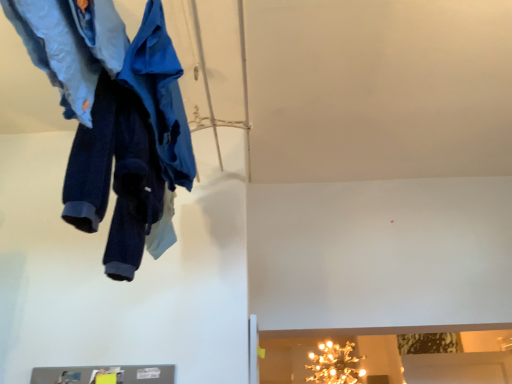
Describe the element at coordinates (335, 364) in the screenshot. I see `gold metallic chandelier at upper center` at that location.

This screenshot has height=384, width=512. I want to click on blue fabric coat at upper left, so pos(161,95).

Find the location of a particular element. The height and width of the screenshot is (384, 512). light fixture to the right of denim pants at upper left, placed as the second trousers when sorted from back to front is located at coordinates (335, 364).

From a real-world perspective, which object stands above the other?

denim pants at upper left, the 1th trousers from the front, is physically above.

Considering the sizes of denim pants at upper left, the 1th trousers from the front, and gold metallic chandelier at upper center in the image, is denim pants at upper left, the 1th trousers from the front, taller or shorter than gold metallic chandelier at upper center?

In the image, denim pants at upper left, the 1th trousers from the front, appears to be shorter than gold metallic chandelier at upper center.

From the picture: Considering the relative positions of denim pants at upper left, placed as the second trousers when sorted from back to front, and blue fabric coat at upper left in the image provided, is denim pants at upper left, placed as the second trousers when sorted from back to front, to the right of blue fabric coat at upper left from the viewer's perspective?

No, denim pants at upper left, placed as the second trousers when sorted from back to front, is not to the right of blue fabric coat at upper left.

You are a GUI agent. You are given a task and a screenshot of the screen. Output one action in this format:
    pyautogui.click(x=<x>, y=<y>)
    Task: Click on the 1st trousers directly beneath the blue fabric coat at upper left (from a real-world perspective)
    The height and width of the screenshot is (384, 512).
    Given the screenshot: What is the action you would take?
    pyautogui.click(x=71, y=46)

From the image's perspective, is denim pants at upper left, placed as the second trousers when sorted from back to front, located above blue fabric coat at upper left?

Yes, from the image's perspective, denim pants at upper left, placed as the second trousers when sorted from back to front, is above blue fabric coat at upper left.

Is denim pants at upper left, the 1th trousers from the front, placed right next to blue fabric coat at upper left?

denim pants at upper left, the 1th trousers from the front, and blue fabric coat at upper left are clearly separated.

From the image's perspective, which one is positioned lower, navy blue fleece pants at upper left, which is the second trousers from front to back, or denim pants at upper left, placed as the second trousers when sorted from back to front?

From the image's view, navy blue fleece pants at upper left, which is the second trousers from front to back, is below.

Considering the relative positions of navy blue fleece pants at upper left, which is the second trousers from front to back, and denim pants at upper left, placed as the second trousers when sorted from back to front, in the image provided, is navy blue fleece pants at upper left, which is the second trousers from front to back, to the left of denim pants at upper left, placed as the second trousers when sorted from back to front, from the viewer's perspective?

Incorrect, navy blue fleece pants at upper left, which is the second trousers from front to back, is not on the left side of denim pants at upper left, placed as the second trousers when sorted from back to front.

Is navy blue fleece pants at upper left, which is the second trousers from front to back, turned away from denim pants at upper left, placed as the second trousers when sorted from back to front?

No, navy blue fleece pants at upper left, which is the second trousers from front to back, is not facing the opposite direction of denim pants at upper left, placed as the second trousers when sorted from back to front.

From a real-world perspective, is gold metallic chandelier at upper center below navy blue fleece pants at upper left, which is the first trousers in back-to-front order?

Correct, in the physical world, gold metallic chandelier at upper center is lower than navy blue fleece pants at upper left, which is the first trousers in back-to-front order.

Considering their positions, is gold metallic chandelier at upper center located in front of or behind navy blue fleece pants at upper left, which is the first trousers in back-to-front order?

Clearly, gold metallic chandelier at upper center is behind navy blue fleece pants at upper left, which is the first trousers in back-to-front order.

What's the angular difference between gold metallic chandelier at upper center and navy blue fleece pants at upper left, which is the second trousers from front to back,'s facing directions?

The angle between the facing direction of gold metallic chandelier at upper center and the facing direction of navy blue fleece pants at upper left, which is the second trousers from front to back, is 171 degrees.

From their relative heights in the image, would you say denim pants at upper left, the 1th trousers from the front, is taller or shorter than navy blue fleece pants at upper left, which is the first trousers in back-to-front order?

Clearly, denim pants at upper left, the 1th trousers from the front, is shorter compared to navy blue fleece pants at upper left, which is the first trousers in back-to-front order.

Would you consider denim pants at upper left, the 1th trousers from the front, to be distant from navy blue fleece pants at upper left, which is the first trousers in back-to-front order?

That's not correct — denim pants at upper left, the 1th trousers from the front, is a little close to navy blue fleece pants at upper left, which is the first trousers in back-to-front order.

Is navy blue fleece pants at upper left, which is the second trousers from front to back, a part of denim pants at upper left, placed as the second trousers when sorted from back to front?

No, denim pants at upper left, placed as the second trousers when sorted from back to front, does not contain navy blue fleece pants at upper left, which is the second trousers from front to back.

Is navy blue fleece pants at upper left, which is the first trousers in back-to-front order, outside of gold metallic chandelier at upper center?

navy blue fleece pants at upper left, which is the first trousers in back-to-front order, lies outside gold metallic chandelier at upper center's area.

Who is bigger, navy blue fleece pants at upper left, which is the first trousers in back-to-front order, or gold metallic chandelier at upper center?

gold metallic chandelier at upper center is bigger.

Based on the photo, does navy blue fleece pants at upper left, which is the first trousers in back-to-front order, have a lesser width compared to gold metallic chandelier at upper center?

Yes, navy blue fleece pants at upper left, which is the first trousers in back-to-front order, is thinner than gold metallic chandelier at upper center.

Can you tell me how much navy blue fleece pants at upper left, which is the first trousers in back-to-front order, and gold metallic chandelier at upper center differ in facing direction?

The facing directions of navy blue fleece pants at upper left, which is the first trousers in back-to-front order, and gold metallic chandelier at upper center are 171 degrees apart.

Can you confirm if gold metallic chandelier at upper center is thinner than denim pants at upper left, placed as the second trousers when sorted from back to front?

In fact, gold metallic chandelier at upper center might be wider than denim pants at upper left, placed as the second trousers when sorted from back to front.

Who is shorter, gold metallic chandelier at upper center or denim pants at upper left, the 1th trousers from the front?

With less height is denim pants at upper left, the 1th trousers from the front.

Considering their positions, is gold metallic chandelier at upper center located in front of or behind denim pants at upper left, placed as the second trousers when sorted from back to front?

In the image, gold metallic chandelier at upper center appears behind denim pants at upper left, placed as the second trousers when sorted from back to front.

From a real-world perspective, count 2nd trouserss upward from the gold metallic chandelier at upper center and point to it. Please provide its 2D coordinates.

[(71, 46)]

Identify the location of trousers that is the 1st object directly below the blue fabric coat at upper left (from a real-world perspective). (71, 46).

Considering their positions, is blue fabric coat at upper left positioned closer to gold metallic chandelier at upper center than denim pants at upper left, placed as the second trousers when sorted from back to front?

The object closer to gold metallic chandelier at upper center is blue fabric coat at upper left.

Estimate the real-world distances between objects in this image. Which object is closer to gold metallic chandelier at upper center, navy blue fleece pants at upper left, which is the second trousers from front to back, or blue fabric coat at upper left?

The object closer to gold metallic chandelier at upper center is navy blue fleece pants at upper left, which is the second trousers from front to back.

Which object lies nearer to the anchor point blue fabric coat at upper left, gold metallic chandelier at upper center or navy blue fleece pants at upper left, which is the second trousers from front to back?

navy blue fleece pants at upper left, which is the second trousers from front to back.

Consider the image. Which object lies further to the anchor point denim pants at upper left, the 1th trousers from the front, blue fabric coat at upper left or gold metallic chandelier at upper center?

The object further to denim pants at upper left, the 1th trousers from the front, is gold metallic chandelier at upper center.

Estimate the real-world distances between objects in this image. Which object is further from gold metallic chandelier at upper center, blue fabric coat at upper left or navy blue fleece pants at upper left, which is the first trousers in back-to-front order?

The object further to gold metallic chandelier at upper center is blue fabric coat at upper left.

Estimate the real-world distances between objects in this image. Which object is closer to navy blue fleece pants at upper left, which is the first trousers in back-to-front order, blue fabric coat at upper left or denim pants at upper left, placed as the second trousers when sorted from back to front?

blue fabric coat at upper left is positioned closer to the anchor navy blue fleece pants at upper left, which is the first trousers in back-to-front order.

Considering their positions, is navy blue fleece pants at upper left, which is the first trousers in back-to-front order, positioned further to gold metallic chandelier at upper center than denim pants at upper left, the 1th trousers from the front?

The object further to gold metallic chandelier at upper center is denim pants at upper left, the 1th trousers from the front.

Estimate the real-world distances between objects in this image. Which object is closer to gold metallic chandelier at upper center, denim pants at upper left, placed as the second trousers when sorted from back to front, or navy blue fleece pants at upper left, which is the second trousers from front to back?

The object closer to gold metallic chandelier at upper center is navy blue fleece pants at upper left, which is the second trousers from front to back.

What are the coordinates of `trousers between denim pants at upper left, the 1th trousers from the front, and gold metallic chandelier at upper center, along the z-axis` in the screenshot? It's located at (131, 147).

The height and width of the screenshot is (384, 512). In order to click on cloak between navy blue fleece pants at upper left, which is the second trousers from front to back, and gold metallic chandelier at upper center, along the z-axis in this screenshot , I will do `click(161, 95)`.

The width and height of the screenshot is (512, 384). I want to click on trousers between denim pants at upper left, the 1th trousers from the front, and blue fabric coat at upper left in the front-back direction, so click(x=131, y=147).

Identify the location of cloak between denim pants at upper left, placed as the second trousers when sorted from back to front, and gold metallic chandelier at upper center, along the z-axis. (161, 95).